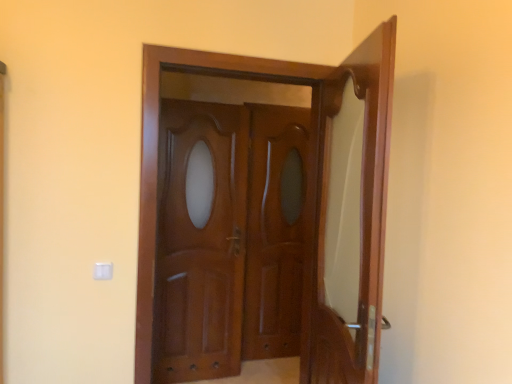
Find the location of `glossy wood door at center, which is the 2th door in right-to-left order`. glossy wood door at center, which is the 2th door in right-to-left order is located at coordinates (306, 195).

What do you see at coordinates (200, 241) in the screenshot? I see `mahogany wood door at center` at bounding box center [200, 241].

What do you see at coordinates (275, 231) in the screenshot? The image size is (512, 384). I see `glossy wood door at center` at bounding box center [275, 231].

Find the location of a particular element. This screenshot has width=512, height=384. glossy wood door at center, positioned as the first door in left-to-right order is located at coordinates (306, 195).

Would you say mahogany wood door at center is inside or outside glossy wood door at center, which is the 2th door in right-to-left order?

mahogany wood door at center exists outside the volume of glossy wood door at center, which is the 2th door in right-to-left order.

Does mahogany wood door at center have a greater height compared to glossy wood door at center, positioned as the first door in left-to-right order?

Yes, mahogany wood door at center is taller than glossy wood door at center, positioned as the first door in left-to-right order.

Is mahogany wood door at center behind glossy wood door at center, positioned as the first door in left-to-right order?

Yes, mahogany wood door at center is behind glossy wood door at center, positioned as the first door in left-to-right order.

Could you tell me if mahogany wood door at center is turned towards glossy wood door at center, positioned as the first door in left-to-right order?

Yes.

From the picture: Can you see glossy wood door at center, positioned as the first door in left-to-right order, touching mahogany wood door at right, positioned as the 2th door in left-to-right order?

Yes, glossy wood door at center, positioned as the first door in left-to-right order, is touching mahogany wood door at right, positioned as the 2th door in left-to-right order.

Considering the sizes of objects glossy wood door at center, which is the 2th door in right-to-left order, and mahogany wood door at right, positioned as the 2th door in left-to-right order, in the image provided, who is thinner, glossy wood door at center, which is the 2th door in right-to-left order, or mahogany wood door at right, positioned as the 2th door in left-to-right order,?

glossy wood door at center, which is the 2th door in right-to-left order.

From a real-world perspective, relative to mahogany wood door at right, which appears as the 1th door when viewed from the right, is glossy wood door at center, positioned as the first door in left-to-right order, vertically above or below?

glossy wood door at center, positioned as the first door in left-to-right order, is situated higher than mahogany wood door at right, which appears as the 1th door when viewed from the right, in the real world.

Is glossy wood door at center, positioned as the first door in left-to-right order, turned away from mahogany wood door at right, positioned as the 2th door in left-to-right order?

No, glossy wood door at center, positioned as the first door in left-to-right order,'s orientation is not away from mahogany wood door at right, positioned as the 2th door in left-to-right order.

Relative to mahogany wood door at right, positioned as the 2th door in left-to-right order, is glossy wood door at center in front or behind?

Clearly, glossy wood door at center is behind mahogany wood door at right, positioned as the 2th door in left-to-right order.

From the image's perspective, which one is positioned lower, glossy wood door at center or mahogany wood door at right, positioned as the 2th door in left-to-right order?

From the image's view, glossy wood door at center is below.

How different are the orientations of glossy wood door at center and mahogany wood door at right, positioned as the 2th door in left-to-right order, in degrees?

The facing directions of glossy wood door at center and mahogany wood door at right, positioned as the 2th door in left-to-right order, are 106 degrees apart.

From their relative heights in the image, would you say glossy wood door at center is taller or shorter than mahogany wood door at right, which appears as the 1th door when viewed from the right?

In the image, glossy wood door at center appears to be taller than mahogany wood door at right, which appears as the 1th door when viewed from the right.

The width and height of the screenshot is (512, 384). In order to click on screen door that is under the mahogany wood door at right, positioned as the 2th door in left-to-right order (from a real-world perspective) in this screenshot , I will do `click(275, 231)`.

Looking at this image, who is shorter, mahogany wood door at right, positioned as the 2th door in left-to-right order, or glossy wood door at center?

Standing shorter between the two is mahogany wood door at right, positioned as the 2th door in left-to-right order.

Considering the positions of objects mahogany wood door at right, positioned as the 2th door in left-to-right order, and glossy wood door at center in the image provided, who is more to the left, mahogany wood door at right, positioned as the 2th door in left-to-right order, or glossy wood door at center?

glossy wood door at center is more to the left.

Considering the sizes of mahogany wood door at right, which appears as the 1th door when viewed from the right, and glossy wood door at center in the image, is mahogany wood door at right, which appears as the 1th door when viewed from the right, wider or thinner than glossy wood door at center?

Considering their sizes, mahogany wood door at right, which appears as the 1th door when viewed from the right, looks broader than glossy wood door at center.

Does mahogany wood door at right, positioned as the 2th door in left-to-right order, appear on the left side of mahogany wood door at center?

No.

Considering their positions, is mahogany wood door at right, which appears as the 1th door when viewed from the right, located in front of or behind mahogany wood door at center?

Visually, mahogany wood door at right, which appears as the 1th door when viewed from the right, is located in front of mahogany wood door at center.

Is mahogany wood door at right, which appears as the 1th door when viewed from the right, spatially inside mahogany wood door at center, or outside of it?

mahogany wood door at right, which appears as the 1th door when viewed from the right, is outside mahogany wood door at center.

From the image's perspective, who appears lower, mahogany wood door at center or glossy wood door at center?

mahogany wood door at center is shown below in the image.

Is point (240, 296) closer to camera compared to point (300, 278)?

Yes, it is.

Would you say glossy wood door at center is part of mahogany wood door at center's contents?

That's incorrect, glossy wood door at center is not inside mahogany wood door at center.

How different are the orientations of mahogany wood door at center and glossy wood door at center in degrees?

0.000391 degrees separate the facing orientations of mahogany wood door at center and glossy wood door at center.

From a real-world perspective, which is physically above, mahogany wood door at right, which appears as the 1th door when viewed from the right, or glossy wood door at center, positioned as the first door in left-to-right order?

glossy wood door at center, positioned as the first door in left-to-right order, is physically above.

Is mahogany wood door at right, positioned as the 2th door in left-to-right order, not near glossy wood door at center, positioned as the first door in left-to-right order?

mahogany wood door at right, positioned as the 2th door in left-to-right order, is near glossy wood door at center, positioned as the first door in left-to-right order, not far away.

Is mahogany wood door at right, positioned as the 2th door in left-to-right order, further to camera compared to glossy wood door at center, positioned as the first door in left-to-right order?

No.

Considering the sizes of objects mahogany wood door at right, positioned as the 2th door in left-to-right order, and glossy wood door at center, positioned as the first door in left-to-right order, in the image provided, who is taller, mahogany wood door at right, positioned as the 2th door in left-to-right order, or glossy wood door at center, positioned as the first door in left-to-right order,?

glossy wood door at center, positioned as the first door in left-to-right order.

Identify the location of the 2nd door positioned above the mahogany wood door at center (from the image's perspective). (306, 195).

Identify the location of door in front of the glossy wood door at center, which is the 2th door in right-to-left order. (350, 215).

Estimate the real-world distances between objects in this image. Which object is closer to mahogany wood door at center, glossy wood door at center, positioned as the first door in left-to-right order, or glossy wood door at center?

glossy wood door at center is positioned closer to the anchor mahogany wood door at center.

From the image, which object appears to be nearer to mahogany wood door at right, which appears as the 1th door when viewed from the right, glossy wood door at center, which is the 2th door in right-to-left order, or mahogany wood door at center?

glossy wood door at center, which is the 2th door in right-to-left order, is closer to mahogany wood door at right, which appears as the 1th door when viewed from the right.

Based on their spatial positions, is glossy wood door at center or mahogany wood door at center closer to glossy wood door at center, which is the 2th door in right-to-left order?

mahogany wood door at center is positioned closer to the anchor glossy wood door at center, which is the 2th door in right-to-left order.

Estimate the real-world distances between objects in this image. Which object is further from mahogany wood door at center, glossy wood door at center or mahogany wood door at right, which appears as the 1th door when viewed from the right?

mahogany wood door at right, which appears as the 1th door when viewed from the right, lies further to mahogany wood door at center than the other object.

Based on their spatial positions, is mahogany wood door at center or glossy wood door at center, positioned as the first door in left-to-right order, closer to glossy wood door at center?

Based on the image, mahogany wood door at center appears to be nearer to glossy wood door at center.

Looking at this image, estimate the real-world distances between objects in this image. Which object is closer to glossy wood door at center, which is the 2th door in right-to-left order, mahogany wood door at center or mahogany wood door at right, which appears as the 1th door when viewed from the right?

The object closer to glossy wood door at center, which is the 2th door in right-to-left order, is mahogany wood door at right, which appears as the 1th door when viewed from the right.

Considering their positions, is mahogany wood door at right, which appears as the 1th door when viewed from the right, positioned closer to mahogany wood door at center than glossy wood door at center, which is the 2th door in right-to-left order?

The object closer to mahogany wood door at center is glossy wood door at center, which is the 2th door in right-to-left order.

From the image, which object appears to be nearer to mahogany wood door at right, which appears as the 1th door when viewed from the right, glossy wood door at center or glossy wood door at center, which is the 2th door in right-to-left order?

glossy wood door at center, which is the 2th door in right-to-left order.

Find the location of a particular element. Image resolution: width=512 pixels, height=384 pixels. door located between mahogany wood door at right, positioned as the 2th door in left-to-right order, and glossy wood door at center in the depth direction is located at coordinates (306, 195).

Locate an element on the screen. The height and width of the screenshot is (384, 512). barn door located between mahogany wood door at right, positioned as the 2th door in left-to-right order, and glossy wood door at center in the depth direction is located at coordinates (200, 241).

Identify the location of door between mahogany wood door at right, positioned as the 2th door in left-to-right order, and mahogany wood door at center in the front-back direction. The image size is (512, 384). (306, 195).

You are a GUI agent. You are given a task and a screenshot of the screen. Output one action in this format:
    pyautogui.click(x=<x>, y=<y>)
    Task: Click on the barn door positioned between glossy wood door at center, which is the 2th door in right-to-left order, and glossy wood door at center from near to far
    
    Given the screenshot: What is the action you would take?
    pyautogui.click(x=200, y=241)